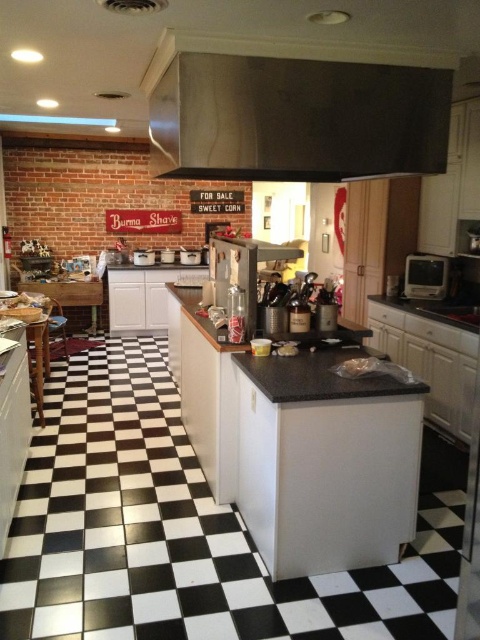
Is stainless steel exhaust hood at upper center smaller than white glossy toaster at center?

Incorrect, stainless steel exhaust hood at upper center is not smaller in size than white glossy toaster at center.

Who is more forward, (x=382, y=140) or (x=135, y=252)?

Point (x=382, y=140) is more forward.

Where is `stainless steel exhaust hood at upper center`? The width and height of the screenshot is (480, 640). stainless steel exhaust hood at upper center is located at coordinates (297, 118).

Looking at this image, is stainless steel exhaust hood at upper center thinner than black granite sink at right?

In fact, stainless steel exhaust hood at upper center might be wider than black granite sink at right.

From the picture: How much distance is there between stainless steel exhaust hood at upper center and black granite sink at right?

stainless steel exhaust hood at upper center is 1.79 meters from black granite sink at right.

At what (x,y) coordinates should I click in order to perform the action: click on stainless steel exhaust hood at upper center. Please return your answer as a coordinate pair (x, y). Image resolution: width=480 pixels, height=640 pixels. Looking at the image, I should click on (297, 118).

Does point (419, 269) come farther from viewer compared to point (143, 250)?

That is False.

How much distance is there between metallic silver toaster at right and white glossy toaster at center?

metallic silver toaster at right and white glossy toaster at center are 3.57 meters apart from each other.

Image resolution: width=480 pixels, height=640 pixels. What are the coordinates of `metallic silver toaster at right` in the screenshot? It's located at (425, 276).

In order to click on metallic silver toaster at right in this screenshot , I will do `click(425, 276)`.